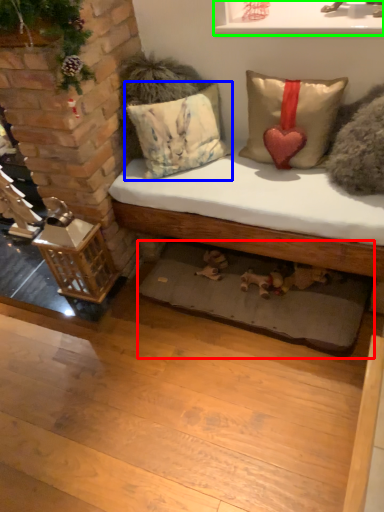
Question: Estimate the real-world distances between objects in this image. Which object is closer to mat (highlighted by a red box), pillow (highlighted by a blue box) or window sill (highlighted by a green box)?

Choices:
 (A) pillow
 (B) window sill

Answer: (A)